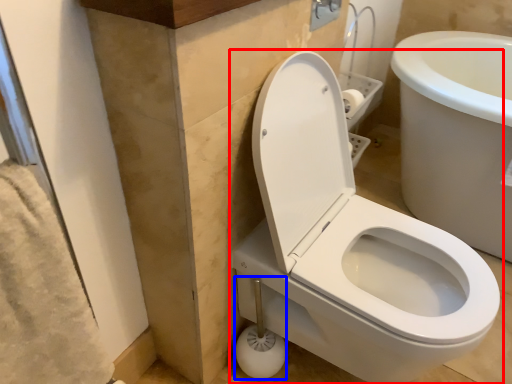
Question: Which object appears farthest to the camera in this image, toilet (highlighted by a red box) or shower (highlighted by a blue box)?

Choices:
 (A) toilet
 (B) shower

Answer: (B)